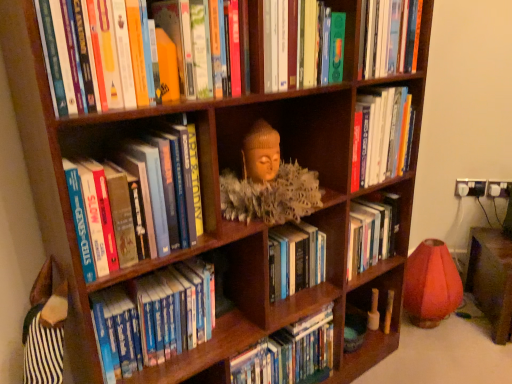
Question: Considering the relative sizes of green matte book at upper center, placed as the 6th book when sorted from bottom to top, and hardcover books at left, positioned as the 3th book in top-to-bottom order, in the image provided, is green matte book at upper center, placed as the 6th book when sorted from bottom to top, smaller than hardcover books at left, positioned as the 3th book in top-to-bottom order,?

Choices:
 (A) no
 (B) yes

Answer: (B)

Question: Does green matte book at upper center, which is counted as the 1th book, starting from the top, come behind hardcover books at left, which ranks as the fourth book in bottom-to-top order?

Choices:
 (A) no
 (B) yes

Answer: (B)

Question: From the image's perspective, is green matte book at upper center, which is counted as the 1th book, starting from the top, above hardcover books at left, which ranks as the fourth book in bottom-to-top order?

Choices:
 (A) yes
 (B) no

Answer: (A)

Question: Is green matte book at upper center, placed as the 6th book when sorted from bottom to top, positioned beyond the bounds of hardcover books at left, positioned as the 3th book in top-to-bottom order?

Choices:
 (A) no
 (B) yes

Answer: (B)

Question: From a real-world perspective, is green matte book at upper center, placed as the 6th book when sorted from bottom to top, on top of hardcover books at left, positioned as the 3th book in top-to-bottom order?

Choices:
 (A) yes
 (B) no

Answer: (A)

Question: Is matte wooden sculpture at center to the left or to the right of hardcover books at center, the second book in the top-to-bottom sequence, in the image?

Choices:
 (A) left
 (B) right

Answer: (A)

Question: In terms of height, does matte wooden sculpture at center look taller or shorter compared to hardcover books at center, the second book in the top-to-bottom sequence?

Choices:
 (A) tall
 (B) short

Answer: (B)

Question: Is matte wooden sculpture at center in front of or behind hardcover books at center, the second book in the top-to-bottom sequence, in the image?

Choices:
 (A) front
 (B) behind

Answer: (A)

Question: From a real-world perspective, is matte wooden sculpture at center positioned above or below hardcover books at center, the second book in the top-to-bottom sequence?

Choices:
 (A) below
 (B) above

Answer: (A)

Question: Considering the positions of matte wooden sculpture at center and hardcover books at center, the 6th book viewed from the top, in the image, is matte wooden sculpture at center taller or shorter than hardcover books at center, the 6th book viewed from the top,?

Choices:
 (A) short
 (B) tall

Answer: (A)

Question: From the image's perspective, is matte wooden sculpture at center positioned above or below hardcover books at center, the 6th book viewed from the top?

Choices:
 (A) below
 (B) above

Answer: (B)

Question: From a real-world perspective, is matte wooden sculpture at center positioned above or below hardcover books at center, marked as the first book in a bottom-to-top arrangement?

Choices:
 (A) above
 (B) below

Answer: (A)

Question: Does point (305, 210) appear closer or farther from the camera than point (320, 326)?

Choices:
 (A) farther
 (B) closer

Answer: (B)

Question: Is hardcover book at center, which ranks as the fourth book in top-to-bottom order, in front of or behind blue hardcover books at center, the fifth book positioned from the top, in the image?

Choices:
 (A) behind
 (B) front

Answer: (A)

Question: From a real-world perspective, is hardcover book at center, which appears as the 3th book when ordered from the bottom, positioned above or below blue hardcover books at center, the fifth book positioned from the top?

Choices:
 (A) below
 (B) above

Answer: (A)